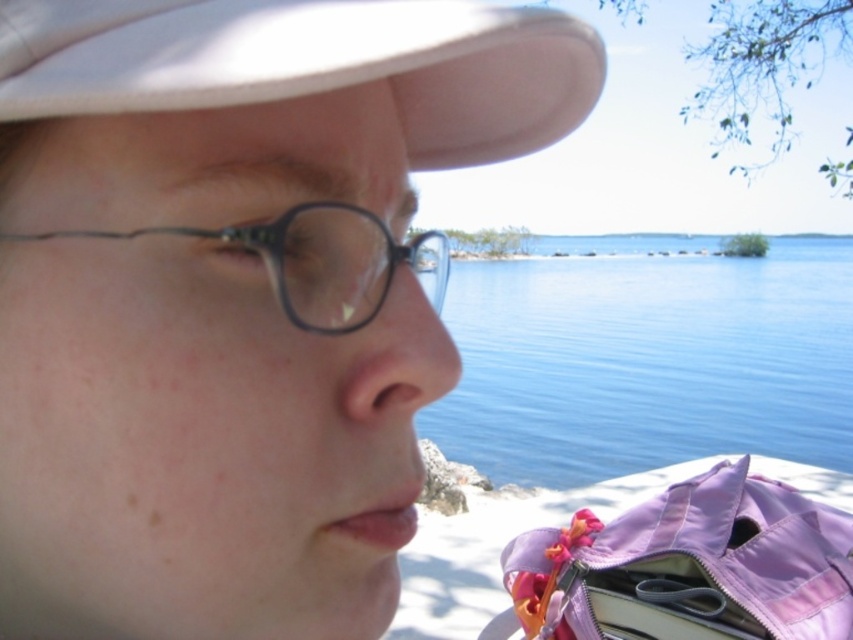
Is matte black glasses at center wider than white matte baseball cap at upper left?

Yes, matte black glasses at center is wider than white matte baseball cap at upper left.

Is matte black glasses at center to the left of white matte baseball cap at upper left from the viewer's perspective?

Indeed, matte black glasses at center is positioned on the left side of white matte baseball cap at upper left.

Locate an element on the screen. The image size is (853, 640). matte black glasses at center is located at coordinates (235, 296).

At what (x,y) coordinates should I click in order to perform the action: click on matte black glasses at center. Please return your answer as a coordinate pair (x, y). This screenshot has width=853, height=640. Looking at the image, I should click on (235, 296).

Who is shorter, white matte baseball cap at upper left or black plastic glasses at left?

black plastic glasses at left

Can you confirm if white matte baseball cap at upper left is positioned above black plastic glasses at left?

Correct, white matte baseball cap at upper left is located above black plastic glasses at left.

Where is `white matte baseball cap at upper left`? white matte baseball cap at upper left is located at coordinates (311, 64).

Does blue water at center have a larger size compared to white matte baseball cap at upper left?

Correct, blue water at center is larger in size than white matte baseball cap at upper left.

Between blue water at center and white matte baseball cap at upper left, which one has more height?

With more height is blue water at center.

Describe the element at coordinates (647, 358) in the screenshot. The image size is (853, 640). I see `blue water at center` at that location.

Locate an element on the screen. blue water at center is located at coordinates (647, 358).